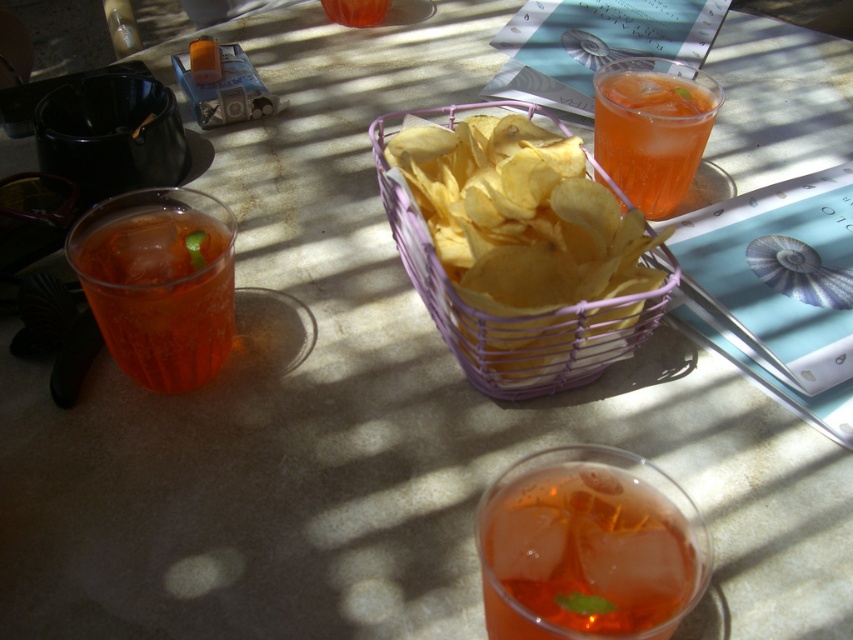
Question: Which of the following is the farthest from the observer?

Choices:
 (A) (117, 252)
 (B) (642, 556)

Answer: (A)

Question: Is purple wire basket at center in front of translucent glass drink at upper right?

Choices:
 (A) yes
 (B) no

Answer: (A)

Question: Which of the following is the closest to the observer?

Choices:
 (A) purple wire basket at center
 (B) translucent glass drink at left
 (C) translucent glass drink at upper right

Answer: (B)

Question: Is purple wire basket at center to the right of translucent glass drink at upper right from the viewer's perspective?

Choices:
 (A) yes
 (B) no

Answer: (B)

Question: Is translucent glass drink at left bigger than translucent glass drink at upper right?

Choices:
 (A) yes
 (B) no

Answer: (B)

Question: Considering the real-world distances, which object is farthest from the translucent glass drink at upper right?

Choices:
 (A) purple wire basket at center
 (B) translucent glass drink at left
 (C) translucent glass drink at lower center

Answer: (B)